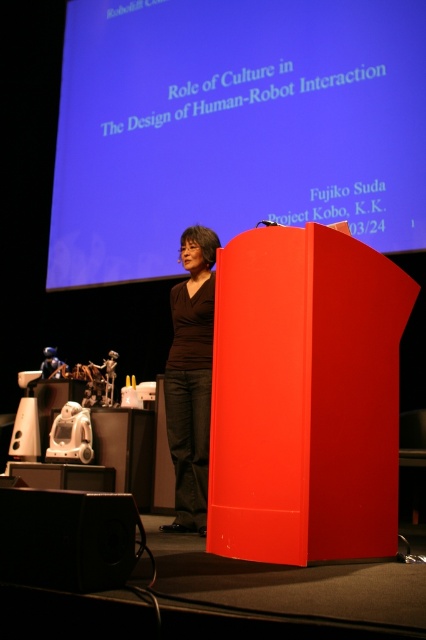
You are a photographer adjusting your camera settings. You notice two points in the scene labeled as point (149,88) and point (172,323). Which point is closer to the camera?

Point (149,88) is further to the camera than point (172,323).

You are an event organizer who needs to place a microphone stand between the black matte speaker at lower left and the brown matte shirt at center. Based on their positions, where should you place the microphone stand?

The black matte speaker at lower left is to the left of the brown matte shirt at center, so the microphone stand should be placed between them, closer to the center side to ensure it is equidistant from both objects.

You are an event organizer setting up the presentation room. You need to ensure that the blue matte projection screen at upper center and the black matte speaker at lower left are visible to all attendees. Based on their heights, which object might require adjustment to ensure visibility?

The black matte speaker at lower left might require adjustment since it is much shorter than the blue matte projection screen at upper center, making it potentially less visible to those sitting further back.